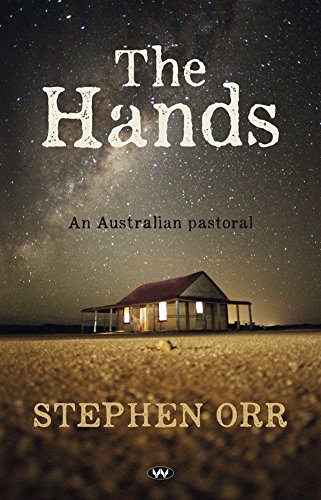
The height and width of the screenshot is (500, 321). I want to click on windows, so click(x=200, y=308), click(x=161, y=309), click(x=125, y=314).